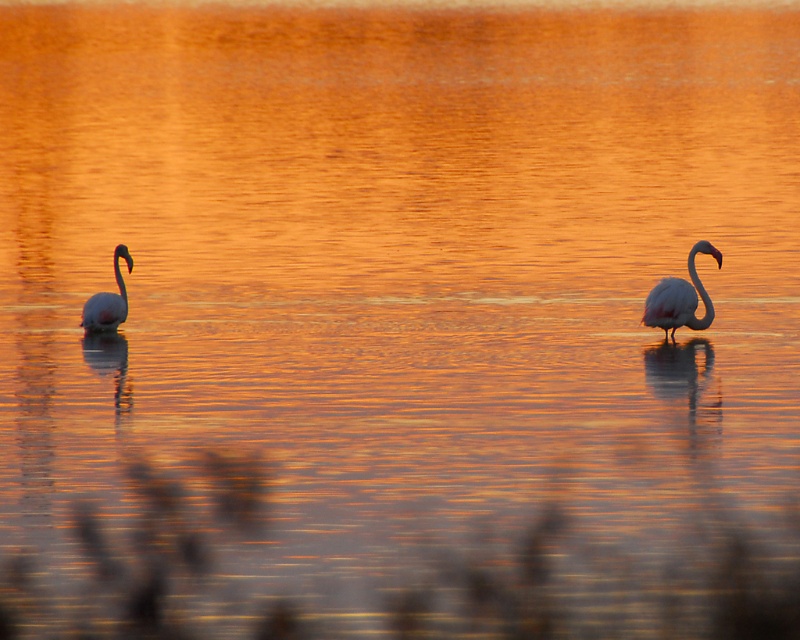
Question: Does pink matte swan at right appear over pink feathered swan at left?

Choices:
 (A) no
 (B) yes

Answer: (B)

Question: Is pink matte swan at right thinner than pink feathered swan at left?

Choices:
 (A) yes
 (B) no

Answer: (B)

Question: Is the position of pink matte swan at right more distant than that of pink feathered swan at left?

Choices:
 (A) no
 (B) yes

Answer: (A)

Question: Among these points, which one is nearest to the camera?

Choices:
 (A) (120, 244)
 (B) (656, 323)

Answer: (B)

Question: Which point is farther to the camera?

Choices:
 (A) pink matte swan at right
 (B) pink feathered swan at left

Answer: (B)